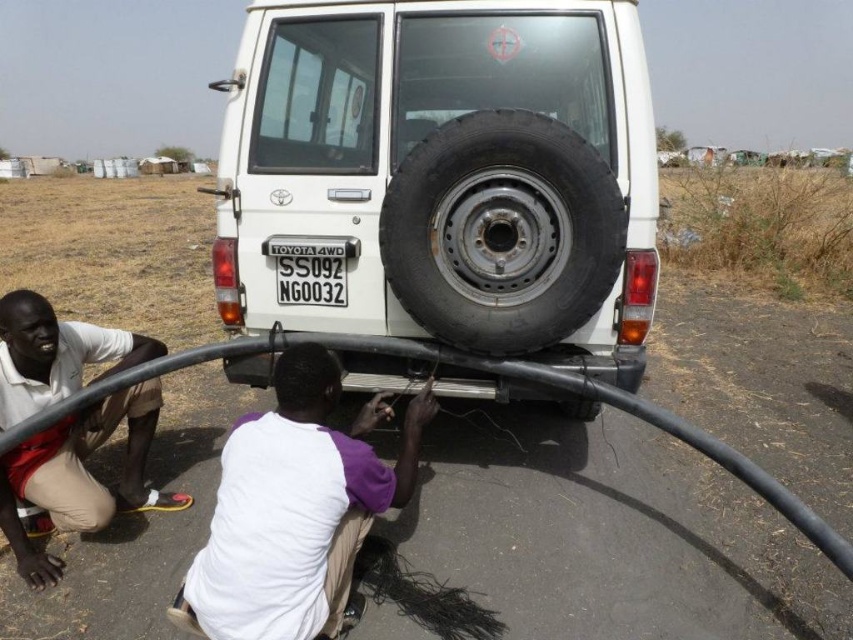
Question: Among these points, which one is nearest to the camera?

Choices:
 (A) (152, 499)
 (B) (323, 321)
 (C) (346, 268)
 (D) (529, 131)

Answer: (D)

Question: Is brown dry soil at lower left thinner than light beige shorts at lower left?

Choices:
 (A) no
 (B) yes

Answer: (A)

Question: Considering the real-world distances, which object is farthest from the white matte van at center?

Choices:
 (A) black rubber tire at rear
 (B) white fabric squat at center
 (C) black plastic license plate at center

Answer: (B)

Question: Which object is the closest to the black plastic license plate at center?

Choices:
 (A) white fabric squat at center
 (B) light beige shorts at lower left
 (C) black rubber tire at rear
 (D) brown dry soil at lower left

Answer: (C)

Question: Does white matte van at center have a smaller size compared to black rubber tire at rear?

Choices:
 (A) no
 (B) yes

Answer: (A)

Question: Can you confirm if brown dry soil at lower left is positioned below light beige shorts at lower left?

Choices:
 (A) yes
 (B) no

Answer: (B)